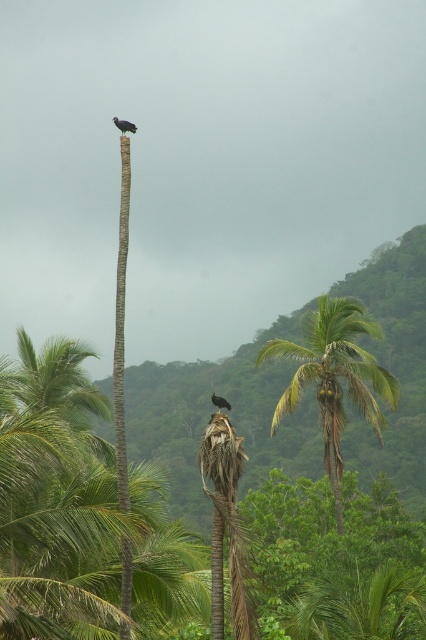
Is the position of green leafy palm tree at center more distant than that of black glossy bird at upper center?

Yes, it is.

Is point (319, 397) positioned before point (215, 404)?

No.

At what (x,y) coordinates should I click in order to perform the action: click on green leafy palm tree at center. Please return your answer as a coordinate pair (x, y). Image resolution: width=426 pixels, height=640 pixels. Looking at the image, I should click on (334, 378).

Which is above, green leafy palm tree at center or dark gray feathers at top?

dark gray feathers at top

Can you confirm if green leafy palm tree at center is positioned to the right of dark gray feathers at top?

Yes, green leafy palm tree at center is to the right of dark gray feathers at top.

In order to click on green leafy palm tree at center in this screenshot , I will do `click(334, 378)`.

Does green leafy coconut tree at center have a lesser height compared to green leafy palm tree at center?

Yes, green leafy coconut tree at center is shorter than green leafy palm tree at center.

Which is more to the left, green leafy coconut tree at center or green leafy palm tree at center?

green leafy coconut tree at center is more to the left.

Between point (48, 451) and point (328, 451), which one is positioned behind?

Point (328, 451)

I want to click on green leafy coconut tree at center, so click(55, 497).